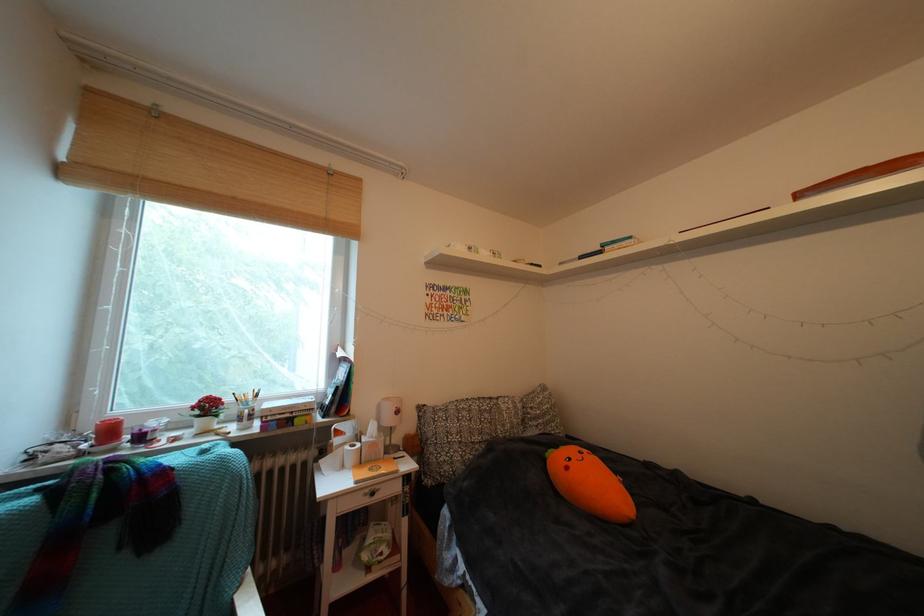
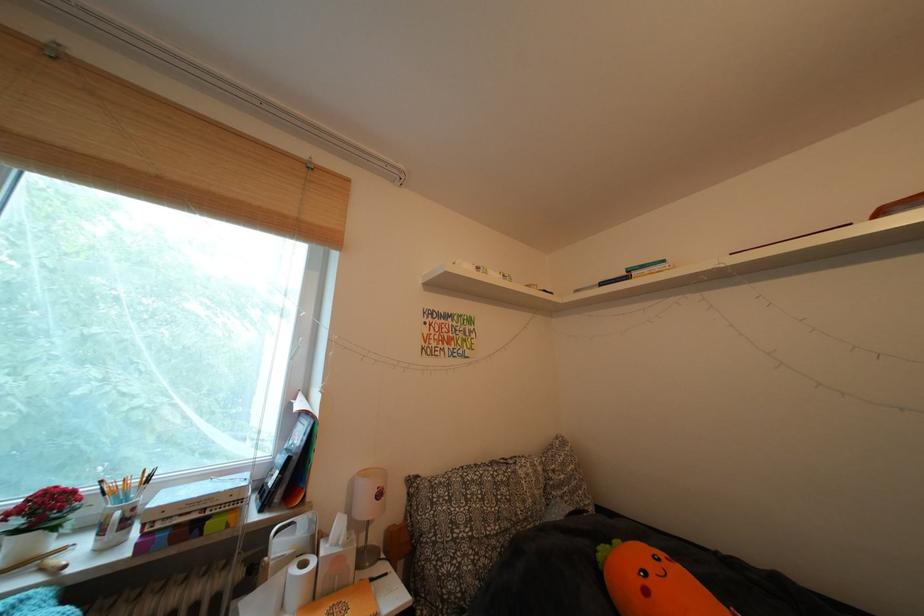
In the second image, find the point that corresponds to point (382, 450) in the first image.

(346, 565)